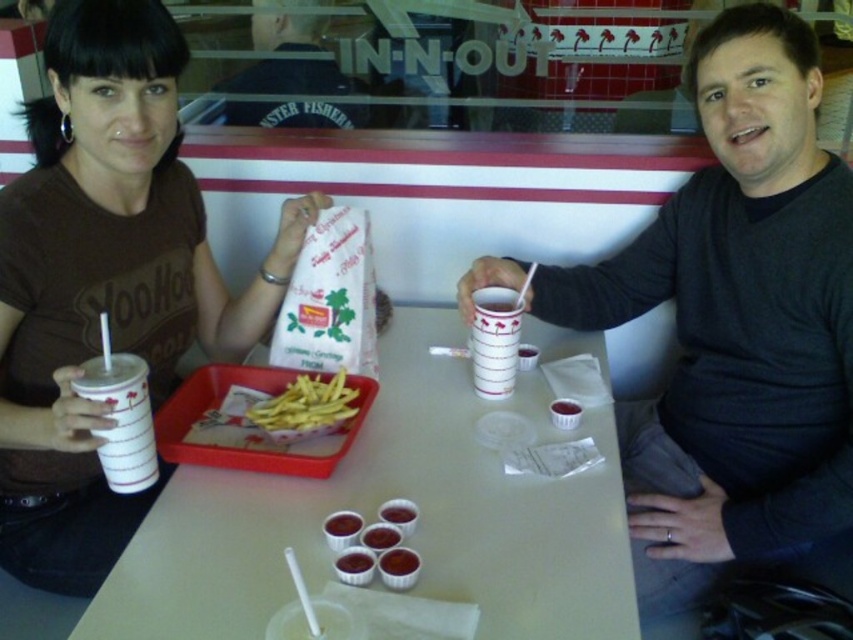
Does point (322, 61) come in front of point (317, 390)?

No, (322, 61) is further to viewer.

Who is more forward, (251, 115) or (334, 385)?

Point (334, 385)

At what (x,y) coordinates should I click in order to perform the action: click on black cotton shirt at center. Please return your answer as a coordinate pair (x, y). Image resolution: width=853 pixels, height=640 pixels. Looking at the image, I should click on (289, 77).

Between matte black shirt at center and white paper cup at center, which one has less height?

Result: With less height is white paper cup at center.

Between point (804, 550) and point (479, 326), which one is positioned behind?

The point (804, 550) is behind.

At what (x,y) coordinates should I click in order to perform the action: click on matte black shirt at center. Please return your answer as a coordinate pair (x, y). Image resolution: width=853 pixels, height=640 pixels. Looking at the image, I should click on (737, 330).

Identify the location of matte black shirt at center. (737, 330).

Does point (283, 113) lie in front of point (337, 570)?

No, it is behind (337, 570).

Does black cotton shirt at center come behind semi-sweet chocolate pudding at center?

Yes, it is.

Identify the location of black cotton shirt at center. The image size is (853, 640). (289, 77).